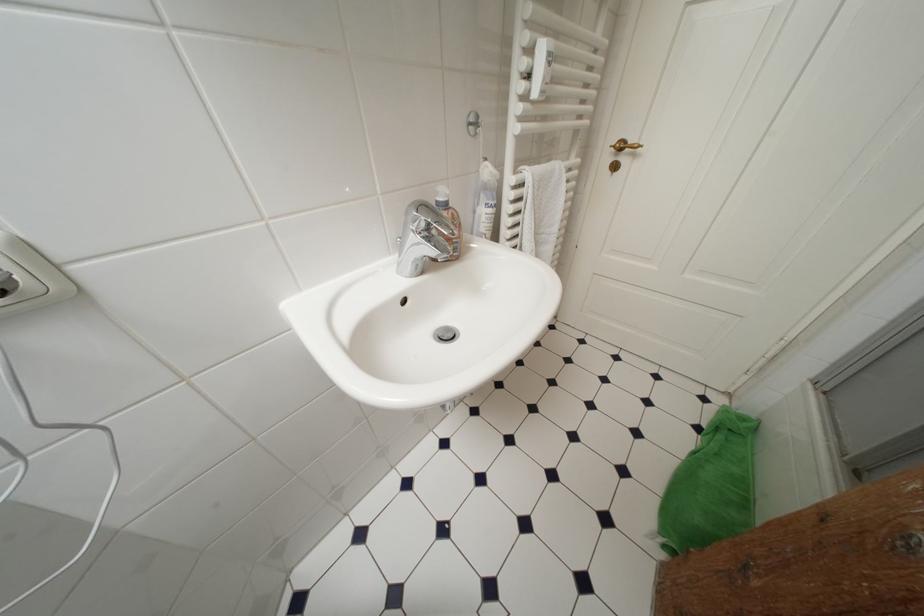
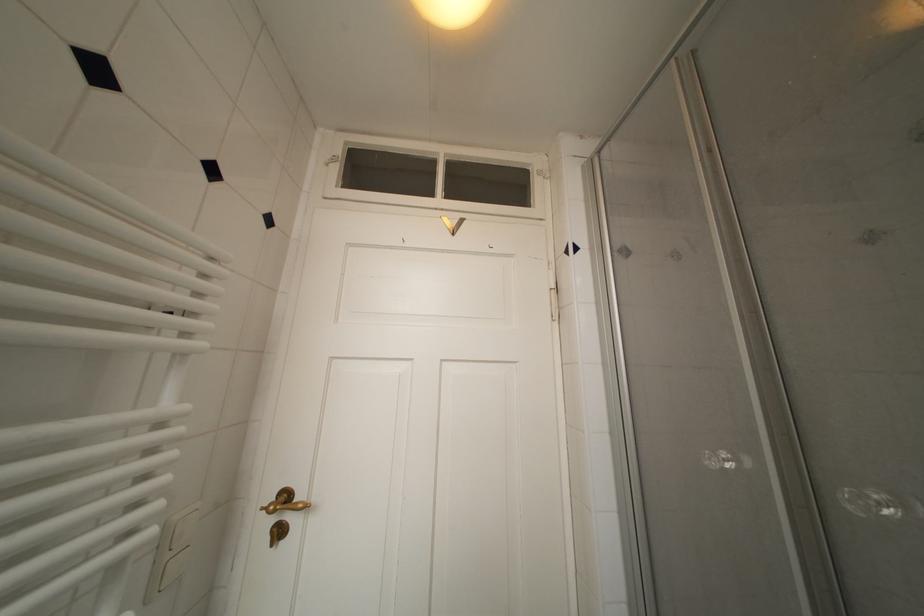
Where in the second image is the point corresponding to (627,148) from the first image?

(293, 500)